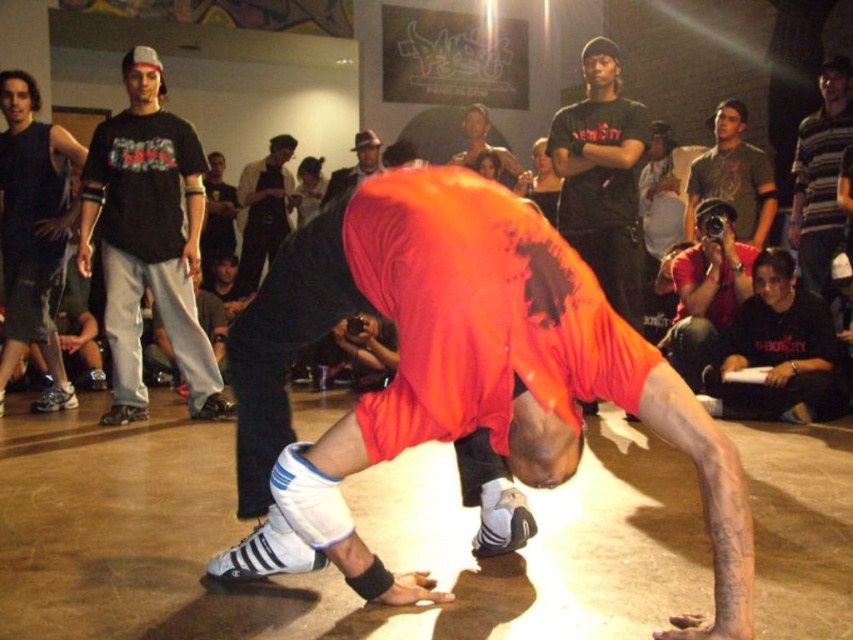
From the picture: You are a photographer at the back of the crowd. You want to take a photo of the breakdancer but need to ensure both the black matte shirt at lower right and the black cotton shirt at center are visible in the frame. Which shirt should you lower your camera angle to focus on to include both?

To include both the black matte shirt at lower right and the black cotton shirt at center in the frame, you should lower your camera angle to focus on the black matte shirt at lower right since it is shorter than the black cotton shirt at center.

Based on the scene description, where is the black matte shirt at lower right located in terms of its 2D coordinates?

The black matte shirt at lower right is located at the 2D coordinates of point (775, 349).